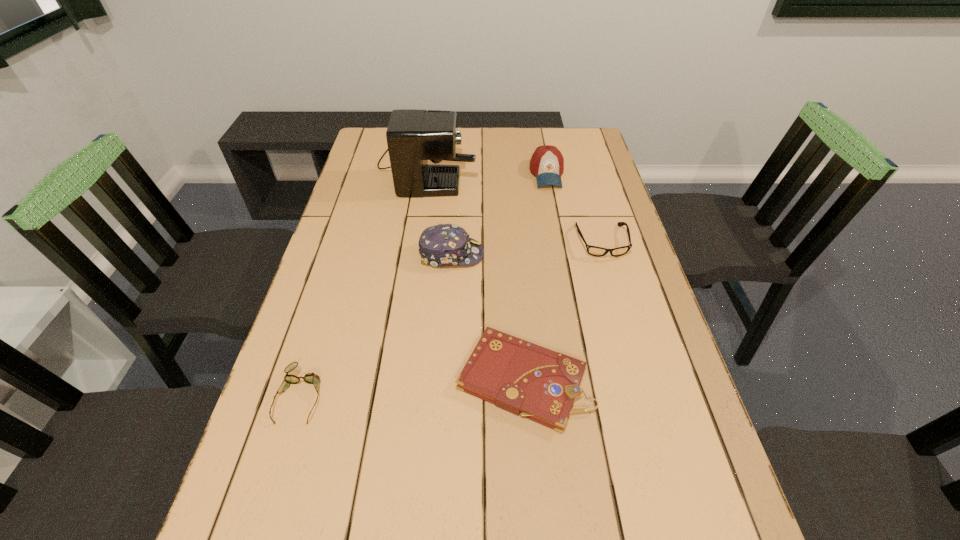
What are the coordinates of `the tallest object` in the screenshot? It's located at (413, 136).

I want to click on baseball cap, so click(x=547, y=163).

The width and height of the screenshot is (960, 540). I want to click on headwear, so click(445, 244).

At what (x,y) coordinates should I click in order to perform the action: click on the taller spectacles. Please return your answer as a coordinate pair (x, y). The height and width of the screenshot is (540, 960). Looking at the image, I should click on (595, 251).

At what (x,y) coordinates should I click in order to perform the action: click on the farther spectacles. Please return your answer as a coordinate pair (x, y). The image size is (960, 540). Looking at the image, I should click on (595, 251).

This screenshot has width=960, height=540. I want to click on notebook, so click(x=518, y=376).

Find the location of `the nearer spectacles`. the nearer spectacles is located at coordinates (311, 378).

Locate an element on the screen. This screenshot has height=540, width=960. the left spectacles is located at coordinates coord(311,378).

Identify the location of vacant space situated on the front-facing side of the tallest object. The width and height of the screenshot is (960, 540). (553, 164).

I want to click on free space located on the front-facing side of the baseball cap, so click(558, 230).